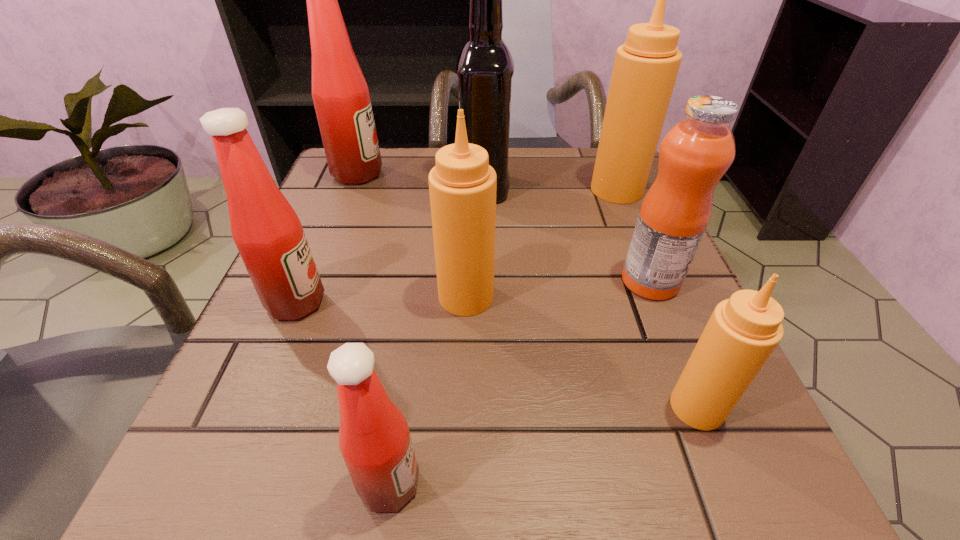
I want to click on the nearest object, so click(x=374, y=439).

What are the coordinates of `free space located on the front-facing side of the liquor` in the screenshot? It's located at (322, 188).

Where is `free spot located 0.220m on the front-facing side of the liquor`? free spot located 0.220m on the front-facing side of the liquor is located at coordinates (355, 188).

What are the coordinates of `free space located 0.200m on the front-facing side of the liquor` in the screenshot? It's located at (365, 188).

What are the coordinates of `free space located 0.330m on the front-facing side of the biggest red condiment` in the screenshot? It's located at (532, 174).

Find the location of a particular element. free location located on the left of the farthest tan condiment is located at coordinates (444, 190).

Where is `vacant space located on the back of the second farthest tan condiment`? vacant space located on the back of the second farthest tan condiment is located at coordinates (468, 221).

The width and height of the screenshot is (960, 540). Find the location of `free spot located on the front-facing side of the second farthest red condiment`. free spot located on the front-facing side of the second farthest red condiment is located at coordinates (497, 302).

Locate an element on the screen. The height and width of the screenshot is (540, 960). vacant space located on the left of the fruit juice is located at coordinates (439, 281).

Locate an element on the screen. The width and height of the screenshot is (960, 540). vacant space located 0.070m on the back of the second nearest condiment is located at coordinates (671, 343).